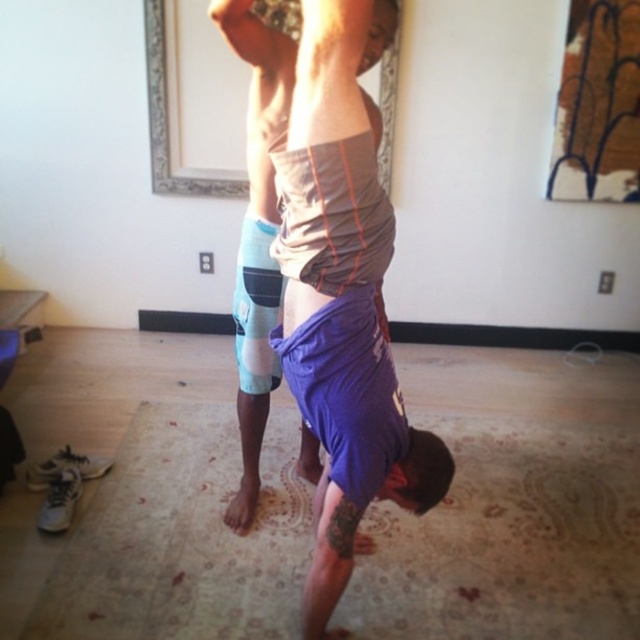
You are trying to determine the position of the purple fabric mat at lower center and the gray matte tank top at center in the image. Which object is located lower in the scene?

The purple fabric mat at lower center is located below the gray matte tank top at center, so it is lower in the scene.

You are standing in the room and want to place a small sticker on the closest point between the two points, point (x=365, y=272) and point (x=232, y=512). Which point should you choose?

Point (x=365, y=272) is closer to the viewer than point (x=232, y=512), so you should choose point (x=365, y=272).